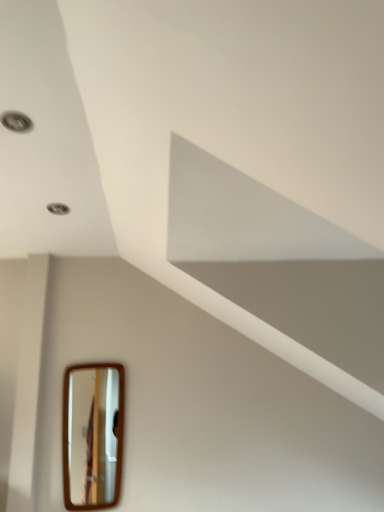
Find the location of a particular element. The image size is (384, 512). wooden-framed mirror at lower left is located at coordinates (92, 435).

This screenshot has height=512, width=384. What do you see at coordinates (92, 435) in the screenshot?
I see `wooden-framed mirror at lower left` at bounding box center [92, 435].

In order to face matte silver droplight at upper left, should I rotate leftwards or rightwards?

You should rotate left by 22.163 degrees.

I want to click on matte silver droplight at upper left, so click(16, 121).

What is the approximate width of matte silver droplight at upper left?

matte silver droplight at upper left is 5.16 inches wide.

This screenshot has height=512, width=384. What do you see at coordinates (16, 121) in the screenshot? I see `matte silver droplight at upper left` at bounding box center [16, 121].

This screenshot has width=384, height=512. I want to click on wooden-framed mirror at lower left, so click(x=92, y=435).

In the image, is wooden-framed mirror at lower left on the left side or the right side of matte silver droplight at upper left?

wooden-framed mirror at lower left is to the right of matte silver droplight at upper left.

Between wooden-framed mirror at lower left and matte silver droplight at upper left, which one is positioned behind?

wooden-framed mirror at lower left is further away from the camera.

Considering the positions of point (86, 404) and point (19, 118), is point (86, 404) closer or farther from the camera than point (19, 118)?

Point (86, 404) is positioned farther from the camera compared to point (19, 118).

From the image's perspective, is wooden-framed mirror at lower left positioned above or below matte silver droplight at upper left?

wooden-framed mirror at lower left is situated lower than matte silver droplight at upper left in the image.

Looking at this image, from a real-world perspective, is wooden-framed mirror at lower left physically located above or below matte silver droplight at upper left?

wooden-framed mirror at lower left is situated lower than matte silver droplight at upper left in the real world.

Looking at this image, which object is thinner, wooden-framed mirror at lower left or matte silver droplight at upper left?

wooden-framed mirror at lower left.

Can you confirm if wooden-framed mirror at lower left is taller than matte silver droplight at upper left?

Yes, wooden-framed mirror at lower left is taller than matte silver droplight at upper left.

Considering the relative sizes of wooden-framed mirror at lower left and matte silver droplight at upper left in the image provided, is wooden-framed mirror at lower left smaller than matte silver droplight at upper left?

Incorrect, wooden-framed mirror at lower left is not smaller in size than matte silver droplight at upper left.

Is wooden-framed mirror at lower left not inside matte silver droplight at upper left?

Yes, wooden-framed mirror at lower left is not within matte silver droplight at upper left.

Is wooden-framed mirror at lower left placed right next to matte silver droplight at upper left?

No, wooden-framed mirror at lower left is not making contact with matte silver droplight at upper left.

Is wooden-framed mirror at lower left facing towards matte silver droplight at upper left?

Yes.

What's the angular difference between wooden-framed mirror at lower left and matte silver droplight at upper left's facing directions?

0.742 degrees separate the facing orientations of wooden-framed mirror at lower left and matte silver droplight at upper left.

At what (x,y) coordinates should I click in order to perform the action: click on mirror located below the matte silver droplight at upper left (from the image's perspective). Please return your answer as a coordinate pair (x, y). Image resolution: width=384 pixels, height=512 pixels. Looking at the image, I should click on (92, 435).

Considering the positions of objects matte silver droplight at upper left and wooden-framed mirror at lower left in the image provided, who is more to the right, matte silver droplight at upper left or wooden-framed mirror at lower left?

wooden-framed mirror at lower left.

Which object is closer to the camera, matte silver droplight at upper left or wooden-framed mirror at lower left?

matte silver droplight at upper left is closer to the camera.

Considering the positions of point (4, 126) and point (77, 403), is point (4, 126) closer or farther from the camera than point (77, 403)?

Point (4, 126) is closer to the camera than point (77, 403).

From the image's perspective, which object appears higher, matte silver droplight at upper left or wooden-framed mirror at lower left?

matte silver droplight at upper left.

From a real-world perspective, is matte silver droplight at upper left physically below wooden-framed mirror at lower left?

No, from a real-world perspective, matte silver droplight at upper left is not under wooden-framed mirror at lower left.

Considering the relative sizes of matte silver droplight at upper left and wooden-framed mirror at lower left in the image provided, is matte silver droplight at upper left thinner than wooden-framed mirror at lower left?

No, matte silver droplight at upper left is not thinner than wooden-framed mirror at lower left.

Considering the sizes of matte silver droplight at upper left and wooden-framed mirror at lower left in the image, is matte silver droplight at upper left taller or shorter than wooden-framed mirror at lower left?

matte silver droplight at upper left is shorter than wooden-framed mirror at lower left.

Can you confirm if matte silver droplight at upper left is smaller than wooden-framed mirror at lower left?

Yes, matte silver droplight at upper left is smaller than wooden-framed mirror at lower left.

Which is correct: matte silver droplight at upper left is inside wooden-framed mirror at lower left, or outside of it?

The correct answer is: outside.

Would you consider matte silver droplight at upper left to be distant from wooden-framed mirror at lower left?

That's right, there is a large distance between matte silver droplight at upper left and wooden-framed mirror at lower left.

Is matte silver droplight at upper left oriented towards wooden-framed mirror at lower left?

No, matte silver droplight at upper left is not oriented towards wooden-framed mirror at lower left.

How many degrees apart are the facing directions of matte silver droplight at upper left and wooden-framed mirror at lower left?

There is a 0.742-degree angle between the facing directions of matte silver droplight at upper left and wooden-framed mirror at lower left.

Identify the location of mirror that is below the matte silver droplight at upper left (from the image's perspective). coord(92,435).

Locate an element on the screen. This screenshot has height=512, width=384. droplight in front of the wooden-framed mirror at lower left is located at coordinates (16, 121).

Where is `mirror behind the matte silver droplight at upper left`? mirror behind the matte silver droplight at upper left is located at coordinates (92, 435).